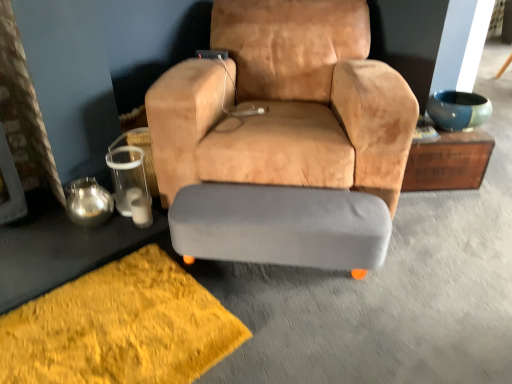
Image resolution: width=512 pixels, height=384 pixels. I want to click on vacant space underneath gray fabric ottoman at center (from a real-world perspective), so click(283, 273).